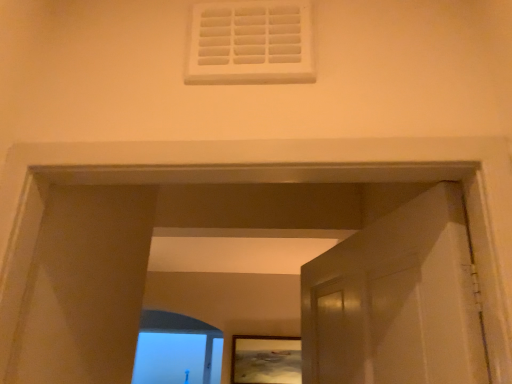
The width and height of the screenshot is (512, 384). I want to click on matte wooden picture frame at center, so click(266, 360).

Measure the distance between matte wooden picture frame at center and camera.

12.18 feet.

What do you see at coordinates (266, 360) in the screenshot?
I see `matte wooden picture frame at center` at bounding box center [266, 360].

Identify the location of clear glass window frame at lower left. (176, 349).

Describe the element at coordinates (176, 349) in the screenshot. I see `clear glass window frame at lower left` at that location.

Identify the location of matte wooden picture frame at center. This screenshot has width=512, height=384. (266, 360).

Between clear glass window frame at lower left and matte wooden picture frame at center, which one appears on the right side from the viewer's perspective?

From the viewer's perspective, matte wooden picture frame at center appears more on the right side.

Looking at this image, is the position of clear glass window frame at lower left more distant than that of matte wooden picture frame at center?

Yes, clear glass window frame at lower left is behind matte wooden picture frame at center.

Considering the positions of point (208, 361) and point (246, 374), is point (208, 361) closer or farther from the camera than point (246, 374)?

Point (208, 361).

From the image's perspective, is clear glass window frame at lower left located above matte wooden picture frame at center?

No, from the image's perspective, clear glass window frame at lower left is not over matte wooden picture frame at center.

From a real-world perspective, is clear glass window frame at lower left positioned over matte wooden picture frame at center based on gravity?

Actually, clear glass window frame at lower left is physically below matte wooden picture frame at center in the real world.

Does clear glass window frame at lower left have a lesser width compared to matte wooden picture frame at center?

No, clear glass window frame at lower left is not thinner than matte wooden picture frame at center.

Between clear glass window frame at lower left and matte wooden picture frame at center, which one has more height?

clear glass window frame at lower left is taller.

Considering the relative sizes of clear glass window frame at lower left and matte wooden picture frame at center in the image provided, is clear glass window frame at lower left smaller than matte wooden picture frame at center?

No, clear glass window frame at lower left is not smaller than matte wooden picture frame at center.

Is clear glass window frame at lower left spatially inside matte wooden picture frame at center, or outside of it?

clear glass window frame at lower left is not inside matte wooden picture frame at center, it's outside.

Is clear glass window frame at lower left in contact with matte wooden picture frame at center?

No, clear glass window frame at lower left is not next to matte wooden picture frame at center.

Is clear glass window frame at lower left oriented away from matte wooden picture frame at center?

No.

Measure the distance between clear glass window frame at lower left and matte wooden picture frame at center.

clear glass window frame at lower left is 21.62 inches away from matte wooden picture frame at center.

Locate an element on the screen. The width and height of the screenshot is (512, 384). picture frame in front of the clear glass window frame at lower left is located at coordinates (266, 360).

Between matte wooden picture frame at center and clear glass window frame at lower left, which one appears on the right side from the viewer's perspective?

Positioned to the right is matte wooden picture frame at center.

Does matte wooden picture frame at center come behind clear glass window frame at lower left?

No, the depth of matte wooden picture frame at center is less than that of clear glass window frame at lower left.

Considering the positions of points (300, 367) and (190, 337), is point (300, 367) closer to camera compared to point (190, 337)?

Yes, point (300, 367) is in front of point (190, 337).

From the image's perspective, relative to clear glass window frame at lower left, is matte wooden picture frame at center above or below?

Based on their image positions, matte wooden picture frame at center is located above clear glass window frame at lower left.

From a real-world perspective, which object rests below the other?

clear glass window frame at lower left.

Can you confirm if matte wooden picture frame at center is thinner than clear glass window frame at lower left?

Indeed, matte wooden picture frame at center has a lesser width compared to clear glass window frame at lower left.

In terms of height, does matte wooden picture frame at center look taller or shorter compared to clear glass window frame at lower left?

matte wooden picture frame at center is shorter than clear glass window frame at lower left.

In terms of size, does matte wooden picture frame at center appear bigger or smaller than clear glass window frame at lower left?

Clearly, matte wooden picture frame at center is smaller in size than clear glass window frame at lower left.

Does matte wooden picture frame at center contain clear glass window frame at lower left?

No, matte wooden picture frame at center does not contain clear glass window frame at lower left.

Is matte wooden picture frame at center touching clear glass window frame at lower left?

No.

Could you tell me if matte wooden picture frame at center is turned towards clear glass window frame at lower left?

No, matte wooden picture frame at center is not facing towards clear glass window frame at lower left.

In order to click on window frame below the matte wooden picture frame at center (from a real-world perspective) in this screenshot , I will do `click(176, 349)`.

I want to click on window frame below the matte wooden picture frame at center (from a real-world perspective), so (176, 349).

Image resolution: width=512 pixels, height=384 pixels. I want to click on picture frame above the clear glass window frame at lower left (from a real-world perspective), so click(266, 360).